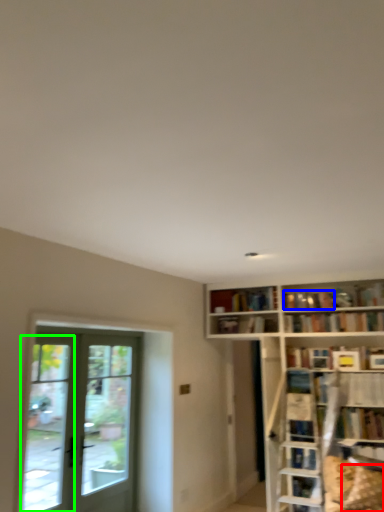
Question: Estimate the real-world distances between objects in this image. Which object is closer to pillow (highlighted by a red box), book (highlighted by a blue box) or window (highlighted by a green box)?

Choices:
 (A) book
 (B) window

Answer: (A)